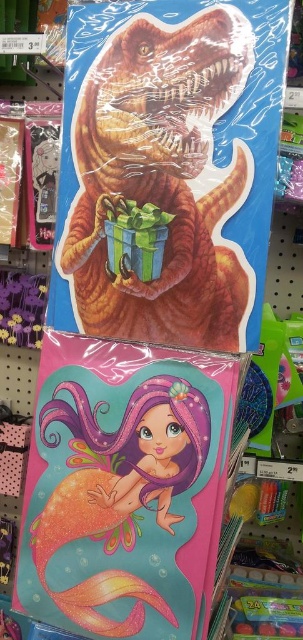
Does shiny plastic dinosaur at center come in front of shiny orange mermaid at lower left?

That is True.

In the scene shown: Is shiny plastic dinosaur at center shorter than shiny orange mermaid at lower left?

In fact, shiny plastic dinosaur at center may be taller than shiny orange mermaid at lower left.

Identify the location of shiny plastic dinosaur at center. (156, 179).